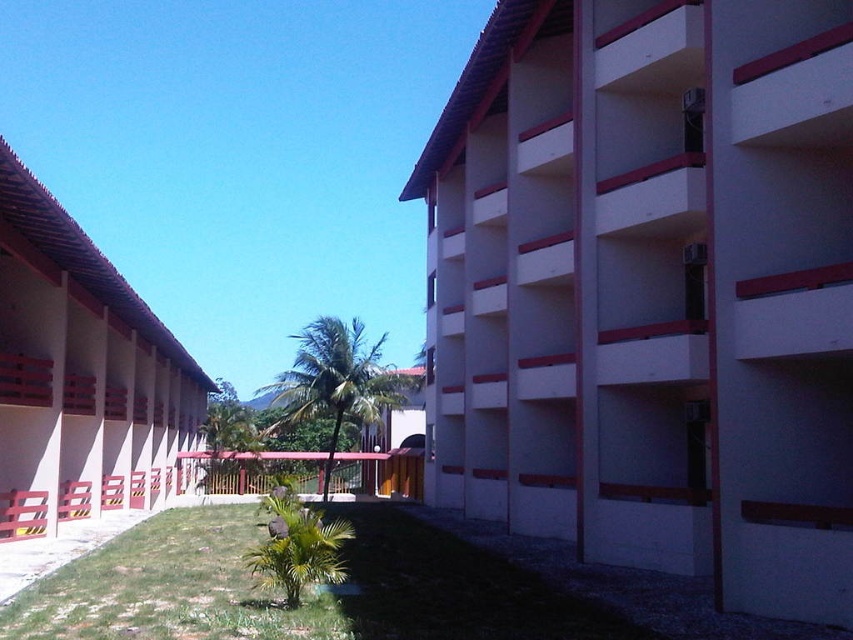
Question: Is white smooth building at center further to the viewer compared to beige concrete building at left?

Choices:
 (A) no
 (B) yes

Answer: (A)

Question: Which point is farther to the camera?

Choices:
 (A) (508, 138)
 (B) (102, 412)

Answer: (B)

Question: Observing the image, what is the correct spatial positioning of white smooth building at center in reference to beige concrete building at left?

Choices:
 (A) right
 (B) left

Answer: (A)

Question: Is white smooth building at center smaller than beige concrete building at left?

Choices:
 (A) yes
 (B) no

Answer: (A)

Question: Which of the following is the farthest from the observer?

Choices:
 (A) white smooth building at center
 (B) beige concrete building at left

Answer: (B)